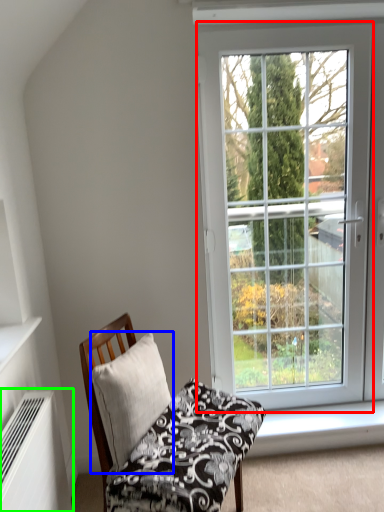
Question: Which object is the farthest from window (highlighted by a red box)? Choose among these: pillow (highlighted by a blue box) or air conditioner (highlighted by a green box).

Choices:
 (A) pillow
 (B) air conditioner

Answer: (B)